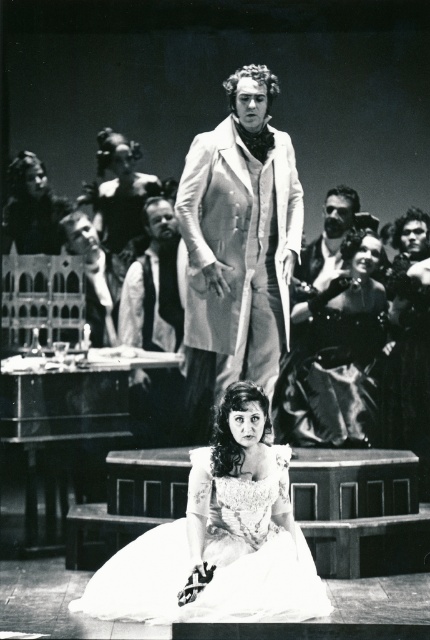
Measure the distance between white satin dress at lower center and camera.

white satin dress at lower center is 7.59 meters away from camera.

Is white satin dress at lower center positioned behind shiny black dress at center?

That is False.

Between point (307, 586) and point (294, 444), which one is positioned behind?

The point (294, 444) is behind.

Identify the location of white satin dress at lower center. (215, 556).

Between silvery metallic coat at center and white satin dress at lower center, which one has more height?

Standing taller between the two is silvery metallic coat at center.

Between silvery metallic coat at center and white satin dress at lower center, which one is positioned higher?

silvery metallic coat at center

In order to click on silvery metallic coat at center in this screenshot , I will do `click(239, 243)`.

Locate an element on the screen. silvery metallic coat at center is located at coordinates (239, 243).

Is silvery metallic coat at center taller than shiny black dress at center?

Correct, silvery metallic coat at center is much taller as shiny black dress at center.

How distant is silvery metallic coat at center from shiny black dress at center?

silvery metallic coat at center is 1.50 meters away from shiny black dress at center.

This screenshot has width=430, height=640. In order to click on silvery metallic coat at center in this screenshot , I will do `click(239, 243)`.

Locate an element on the screen. This screenshot has height=640, width=430. silvery metallic coat at center is located at coordinates (239, 243).